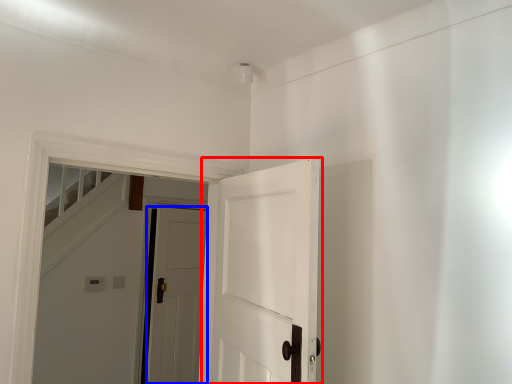
Question: Which of the following is the closest to the observer, door (highlighted by a red box) or door (highlighted by a blue box)?

Choices:
 (A) door
 (B) door

Answer: (A)